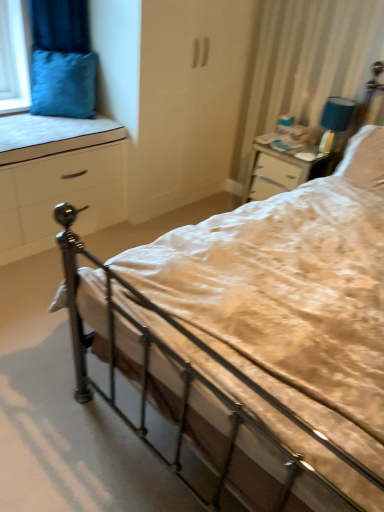
Question: Considering the relative positions of white soft pillow at upper right, the 2th pillow viewed from the left, and velvety blue pillow at upper left, which is the second pillow in right-to-left order, in the image provided, is white soft pillow at upper right, the 2th pillow viewed from the left, behind velvety blue pillow at upper left, which is the second pillow in right-to-left order,?

Choices:
 (A) yes
 (B) no

Answer: (B)

Question: Is velvety blue pillow at upper left, which is the second pillow in right-to-left order, at the back of white soft pillow at upper right, placed as the first pillow when sorted from right to left?

Choices:
 (A) no
 (B) yes

Answer: (A)

Question: Is the position of white soft pillow at upper right, the 2th pillow viewed from the left, less distant than that of velvety blue pillow at upper left, which is the second pillow in right-to-left order?

Choices:
 (A) yes
 (B) no

Answer: (A)

Question: Does white soft pillow at upper right, the 2th pillow viewed from the left, have a greater height compared to velvety blue pillow at upper left, which is counted as the 1th pillow, starting from the left?

Choices:
 (A) no
 (B) yes

Answer: (A)

Question: From the image's perspective, is white soft pillow at upper right, the 2th pillow viewed from the left, located above velvety blue pillow at upper left, which is counted as the 1th pillow, starting from the left?

Choices:
 (A) no
 (B) yes

Answer: (A)

Question: Is white soft pillow at upper right, the 2th pillow viewed from the left, bigger than velvety blue pillow at upper left, which is counted as the 1th pillow, starting from the left?

Choices:
 (A) no
 (B) yes

Answer: (A)

Question: From the image's perspective, is velvety blue pillow at upper left, which is counted as the 1th pillow, starting from the left, beneath blue fabric lampshade at upper right?

Choices:
 (A) yes
 (B) no

Answer: (B)

Question: Does velvety blue pillow at upper left, which is counted as the 1th pillow, starting from the left, turn towards blue fabric lampshade at upper right?

Choices:
 (A) no
 (B) yes

Answer: (A)

Question: From a real-world perspective, does velvety blue pillow at upper left, which is counted as the 1th pillow, starting from the left, sit lower than blue fabric lampshade at upper right?

Choices:
 (A) yes
 (B) no

Answer: (B)

Question: Considering the relative positions of velvety blue pillow at upper left, which is counted as the 1th pillow, starting from the left, and blue fabric lampshade at upper right in the image provided, is velvety blue pillow at upper left, which is counted as the 1th pillow, starting from the left, to the left of blue fabric lampshade at upper right from the viewer's perspective?

Choices:
 (A) no
 (B) yes

Answer: (B)

Question: Does velvety blue pillow at upper left, which is counted as the 1th pillow, starting from the left, contain blue fabric lampshade at upper right?

Choices:
 (A) yes
 (B) no

Answer: (B)

Question: Considering the relative sizes of velvety blue pillow at upper left, which is counted as the 1th pillow, starting from the left, and blue fabric lampshade at upper right in the image provided, is velvety blue pillow at upper left, which is counted as the 1th pillow, starting from the left, smaller than blue fabric lampshade at upper right?

Choices:
 (A) yes
 (B) no

Answer: (B)

Question: From the image's perspective, is white fabric mattress at left located beneath blue fabric lampshade at upper right?

Choices:
 (A) yes
 (B) no

Answer: (A)